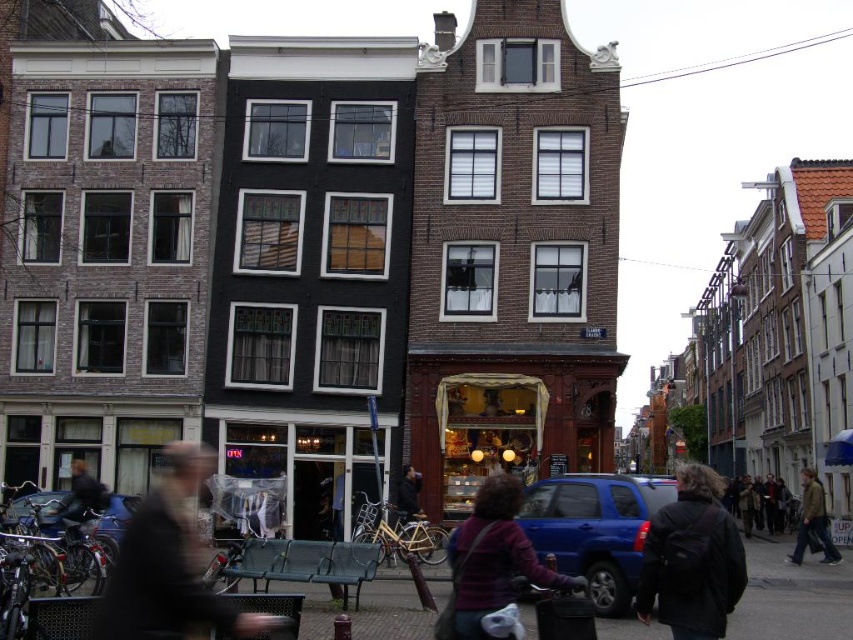
Between blurred plastic bag at center and dark blue jacket at lower left, which one has more height?

With more height is blurred plastic bag at center.

Does blurred plastic bag at center appear on the right side of dark blue jacket at lower left?

Indeed, blurred plastic bag at center is positioned on the right side of dark blue jacket at lower left.

The image size is (853, 640). Describe the element at coordinates (170, 564) in the screenshot. I see `blurred plastic bag at center` at that location.

The image size is (853, 640). Identify the location of blurred plastic bag at center. (170, 564).

Which is behind, point (814, 509) or point (102, 488)?

Point (814, 509)

Is brown leather jacket at lower right bigger than dark blue jacket at lower left?

Correct, brown leather jacket at lower right is larger in size than dark blue jacket at lower left.

The height and width of the screenshot is (640, 853). In order to click on brown leather jacket at lower right in this screenshot , I will do `click(811, 520)`.

Locate an element on the screen. brown leather jacket at lower right is located at coordinates (811, 520).

Is blurred plastic bag at center above blue matte suv at center?

Yes.

Which is in front, point (138, 602) or point (550, 486)?

Point (138, 602)

What do you see at coordinates (170, 564) in the screenshot? The image size is (853, 640). I see `blurred plastic bag at center` at bounding box center [170, 564].

Image resolution: width=853 pixels, height=640 pixels. I want to click on blurred plastic bag at center, so click(x=170, y=564).